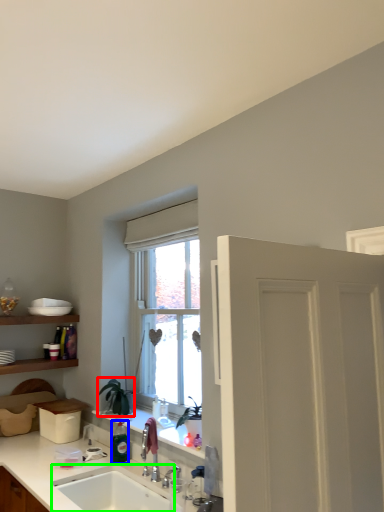
Question: Estimate the real-world distances between objects in this image. Which object is farther from plant (highlighted by a red box), bottle (highlighted by a blue box) or sink (highlighted by a green box)?

Choices:
 (A) bottle
 (B) sink

Answer: (B)